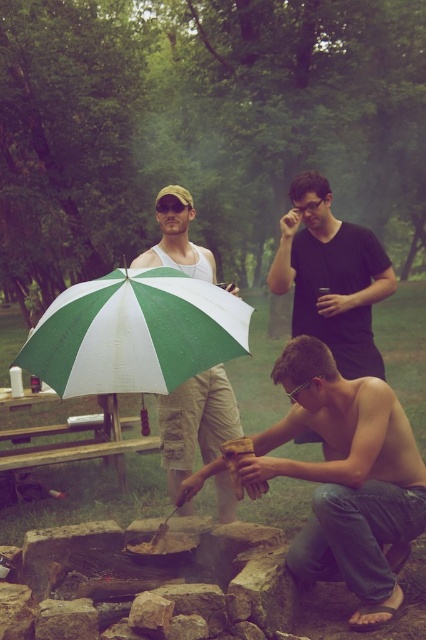
Between wooden log at center and green and white fabric umbrella at center, which one has more height?

Standing taller between the two is wooden log at center.

Is point (322, 467) positioned after point (164, 388)?

Yes, point (322, 467) is farther from viewer.

Between point (328, 529) and point (46, 371), which one is positioned in front?

Point (328, 529) is more forward.

Where is `wooden log at center`? wooden log at center is located at coordinates (345, 477).

I want to click on wooden log at center, so click(x=345, y=477).

Is wooden log at center smaller than black matte shirt at upper center?

Actually, wooden log at center might be larger than black matte shirt at upper center.

Does point (324, 442) come in front of point (368, 266)?

Yes, point (324, 442) is in front of point (368, 266).

Identify the location of wooden log at center. (345, 477).

Is green and white fabric umbrella at center to the left of black matte shirt at upper center from the viewer's perspective?

Yes, green and white fabric umbrella at center is to the left of black matte shirt at upper center.

Does green and white fabric umbrella at center have a greater height compared to black matte shirt at upper center?

Incorrect, green and white fabric umbrella at center's height is not larger of black matte shirt at upper center's.

Is point (230, 332) closer to viewer compared to point (357, 337)?

Yes, point (230, 332) is in front of point (357, 337).

Find the location of `green and white fabric umbrella at center`. green and white fabric umbrella at center is located at coordinates (135, 333).